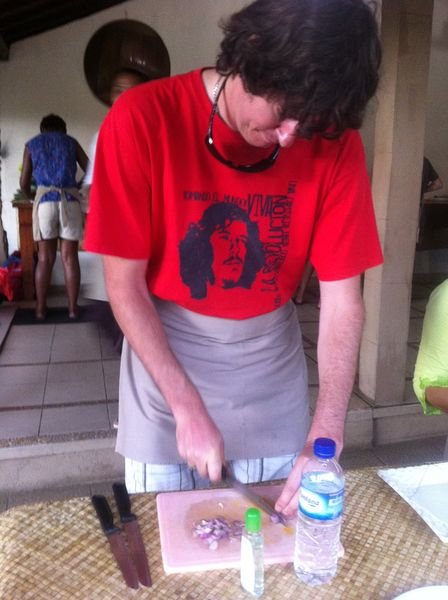
You are a GUI agent. You are given a task and a screenshot of the screen. Output one action in this format:
    pyautogui.click(x=<x>, y=<y>)
    Task: Click on the cutting board
    This screenshot has height=600, width=448.
    Given the screenshot: What is the action you would take?
    pyautogui.click(x=174, y=512)